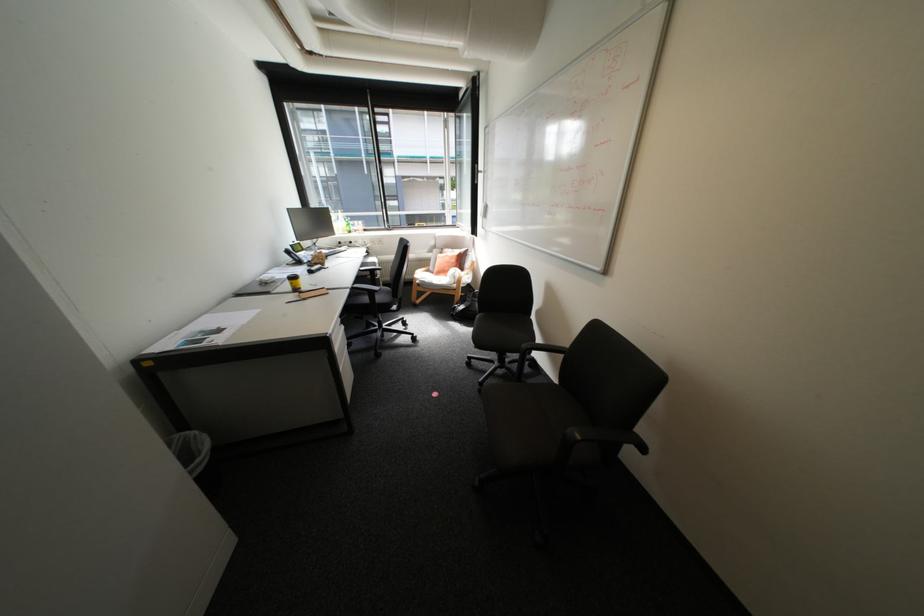
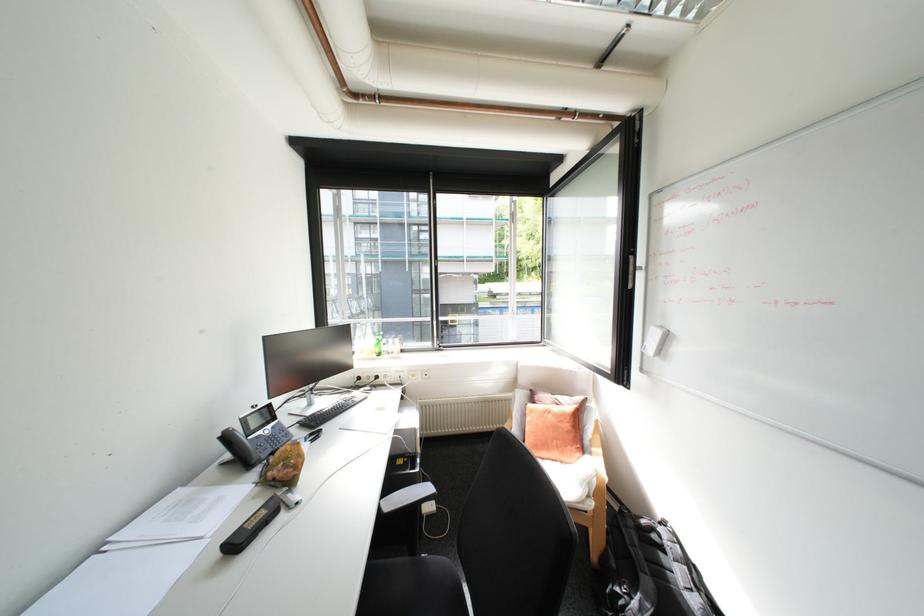
Find the pixel in the second image that matches (456,257) in the first image.

(561, 416)